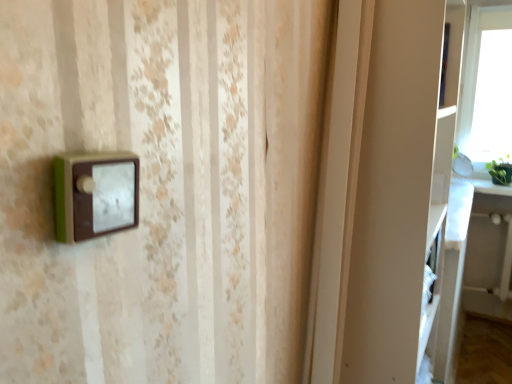
Question: Is white matte cabinet at right wider or thinner than white glossy table at right?

Choices:
 (A) wide
 (B) thin

Answer: (A)

Question: Is point (336, 374) closer or farther from the camera than point (492, 248)?

Choices:
 (A) farther
 (B) closer

Answer: (B)

Question: From the image's perspective, is white matte cabinet at right above or below white glossy table at right?

Choices:
 (A) below
 (B) above

Answer: (B)

Question: Is white glossy table at right situated inside white matte cabinet at right or outside?

Choices:
 (A) outside
 (B) inside

Answer: (A)

Question: From the image's perspective, is white glossy table at right above or below white matte cabinet at right?

Choices:
 (A) below
 (B) above

Answer: (A)

Question: From a real-world perspective, is white glossy table at right above or below white matte cabinet at right?

Choices:
 (A) above
 (B) below

Answer: (B)

Question: Considering the positions of white glossy table at right and white matte cabinet at right in the image, is white glossy table at right wider or thinner than white matte cabinet at right?

Choices:
 (A) wide
 (B) thin

Answer: (B)